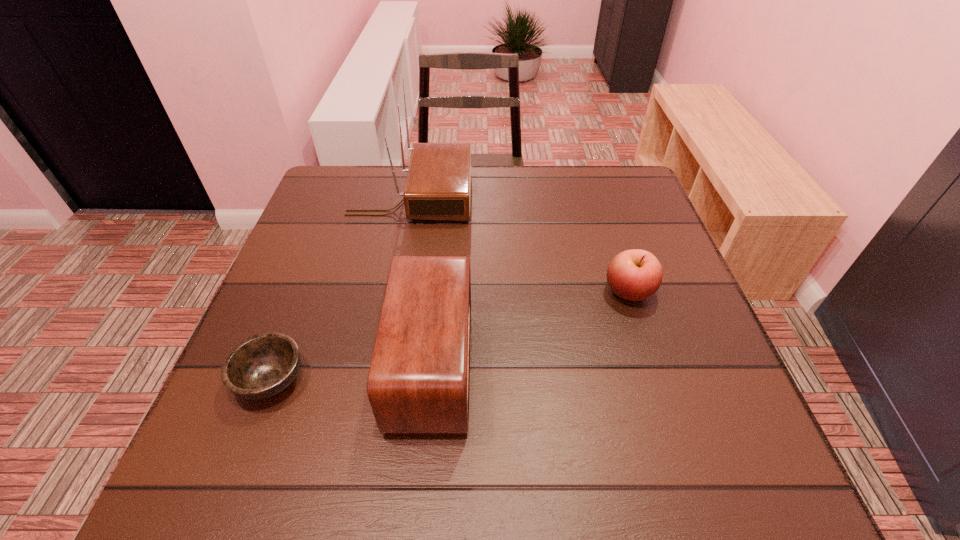
Identify the location of free space located on the right of the shortest object. Image resolution: width=960 pixels, height=540 pixels. (334, 380).

Where is `object situated at the far edge`? Image resolution: width=960 pixels, height=540 pixels. object situated at the far edge is located at coordinates (438, 183).

Identify the location of object that is positioned at the near edge. (419, 378).

This screenshot has height=540, width=960. I want to click on radio_receiver that is positioned at the left edge, so click(438, 183).

Identify the location of bowl that is at the left edge. (262, 366).

This screenshot has height=540, width=960. Find the location of `object that is at the right edge`. object that is at the right edge is located at coordinates (635, 275).

You are a GUI agent. You are given a task and a screenshot of the screen. Output one action in this format:
    pyautogui.click(x=<x>, y=<y>)
    Task: Click on the object that is positioned at the far left corner
    
    Given the screenshot: What is the action you would take?
    pyautogui.click(x=438, y=183)

This screenshot has width=960, height=540. In the image, there is a desktop. Identify the location of vacant space at the far edge. (507, 211).

Find the location of a particular element. The image size is (960, 540). free region at the near edge is located at coordinates (358, 474).

The image size is (960, 540). I want to click on vacant space at the left edge of the desktop, so click(338, 288).